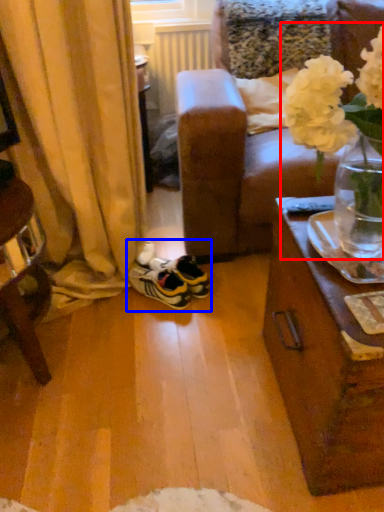
Question: Which object appears closest to the camera in this image, floral arrangement (highlighted by a red box) or footwear (highlighted by a blue box)?

Choices:
 (A) floral arrangement
 (B) footwear

Answer: (A)